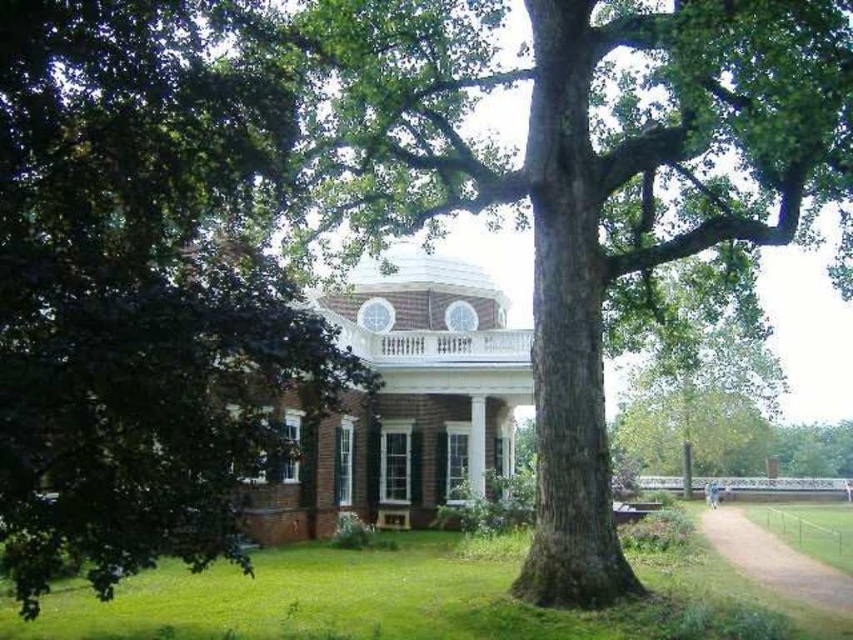
Question: Which of the following is the closest to the observer?

Choices:
 (A) green rough bark tree at center
 (B) white marble column at center
 (C) green leafy tree at left
 (D) dirt/gravel path at lower right

Answer: (C)

Question: Can you confirm if green leafy tree at left is thinner than white marble column at center?

Choices:
 (A) no
 (B) yes

Answer: (A)

Question: Which object is the closest to the dirt/gravel path at lower right?

Choices:
 (A) white marble column at center
 (B) green rough bark tree at center
 (C) green leafy tree at left

Answer: (A)

Question: Estimate the real-world distances between objects in this image. Which object is closer to the white marble column at center?

Choices:
 (A) dirt/gravel path at lower right
 (B) green rough bark tree at center
 (C) green leafy tree at left

Answer: (A)

Question: Can you confirm if green rough bark tree at center is positioned to the left of white marble column at center?

Choices:
 (A) yes
 (B) no

Answer: (B)

Question: Is green leafy tree at left behind dirt/gravel path at lower right?

Choices:
 (A) no
 (B) yes

Answer: (A)